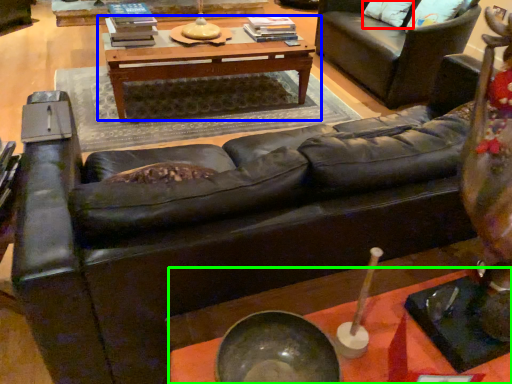
Question: Estimate the real-world distances between objects in this image. Which object is closer to pillow (highlighted by a red box), table (highlighted by a blue box) or table (highlighted by a green box)?

Choices:
 (A) table
 (B) table

Answer: (A)